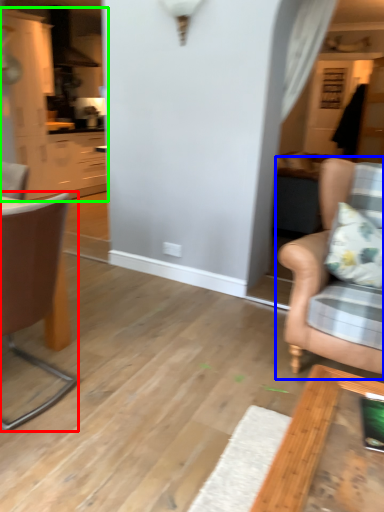
Question: Which object is the closest to the chair (highlighted by a red box)? Choose among these: chair (highlighted by a blue box) or cabinetry (highlighted by a green box).

Choices:
 (A) chair
 (B) cabinetry

Answer: (A)